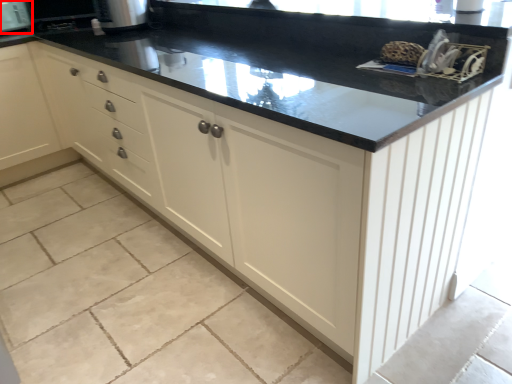
Question: Observing the image, what is the correct spatial positioning of appliance (annotated by the red box) in reference to appliance?

Choices:
 (A) left
 (B) right

Answer: (A)